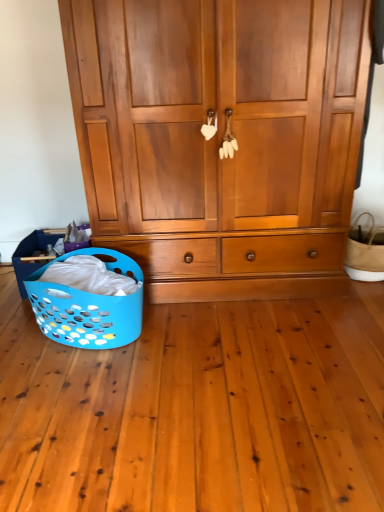
Question: Is wooden wardrobe at center taller than natural woven basket at right, acting as the second basket starting from the left?

Choices:
 (A) yes
 (B) no

Answer: (A)

Question: Would you say natural woven basket at right, acting as the second basket starting from the left, is part of wooden wardrobe at center's contents?

Choices:
 (A) yes
 (B) no

Answer: (B)

Question: Can you confirm if wooden wardrobe at center is wider than natural woven basket at right, arranged as the 1th basket when viewed from the right?

Choices:
 (A) no
 (B) yes

Answer: (B)

Question: Considering the relative positions of wooden wardrobe at center and natural woven basket at right, acting as the second basket starting from the left, in the image provided, is wooden wardrobe at center to the left of natural woven basket at right, acting as the second basket starting from the left, from the viewer's perspective?

Choices:
 (A) no
 (B) yes

Answer: (B)

Question: Can you confirm if wooden wardrobe at center is thinner than natural woven basket at right, arranged as the 1th basket when viewed from the right?

Choices:
 (A) no
 (B) yes

Answer: (A)

Question: Looking at their shapes, would you say blue plastic laundry basket at lower left, the 1th basket when ordered from left to right, is wider or thinner than wooden wardrobe at center?

Choices:
 (A) thin
 (B) wide

Answer: (A)

Question: From their relative heights in the image, would you say blue plastic laundry basket at lower left, the 1th basket when ordered from left to right, is taller or shorter than wooden wardrobe at center?

Choices:
 (A) short
 (B) tall

Answer: (A)

Question: From a real-world perspective, is blue plastic laundry basket at lower left, placed as the 2th basket when sorted from right to left, positioned above or below wooden wardrobe at center?

Choices:
 (A) below
 (B) above

Answer: (A)

Question: Is point (125, 336) positioned closer to the camera than point (336, 126)?

Choices:
 (A) farther
 (B) closer

Answer: (B)

Question: From a real-world perspective, relative to blue plastic laundry basket at lower left, placed as the 2th basket when sorted from right to left, is natural woven basket at right, acting as the second basket starting from the left, vertically above or below?

Choices:
 (A) below
 (B) above

Answer: (A)

Question: Based on their sizes in the image, would you say natural woven basket at right, arranged as the 1th basket when viewed from the right, is bigger or smaller than blue plastic laundry basket at lower left, placed as the 2th basket when sorted from right to left?

Choices:
 (A) small
 (B) big

Answer: (A)

Question: Would you say natural woven basket at right, acting as the second basket starting from the left, is to the left or to the right of blue plastic laundry basket at lower left, the 1th basket when ordered from left to right, in the picture?

Choices:
 (A) right
 (B) left

Answer: (A)

Question: Is natural woven basket at right, acting as the second basket starting from the left, in front of or behind blue plastic laundry basket at lower left, placed as the 2th basket when sorted from right to left, in the image?

Choices:
 (A) front
 (B) behind

Answer: (B)

Question: From the image's perspective, relative to natural woven basket at right, acting as the second basket starting from the left, is wooden wardrobe at center above or below?

Choices:
 (A) above
 (B) below

Answer: (A)

Question: Which is correct: wooden wardrobe at center is inside natural woven basket at right, arranged as the 1th basket when viewed from the right, or outside of it?

Choices:
 (A) outside
 (B) inside

Answer: (A)